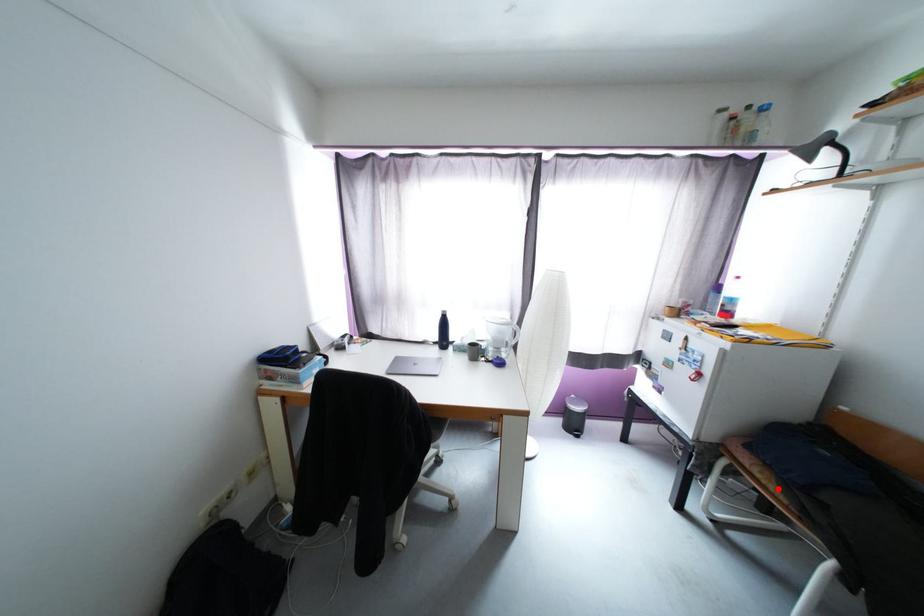
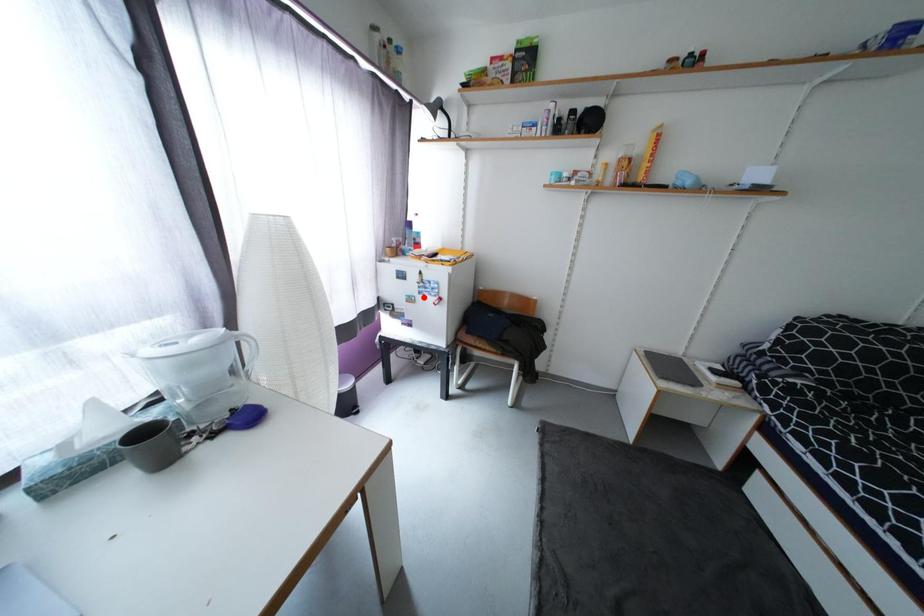
I am providing you with two images of the same scene from different viewpoints. A red point is marked on the first image and another point is marked on the second image. Is the red point in image1 aligned with the point shown in image2?

No